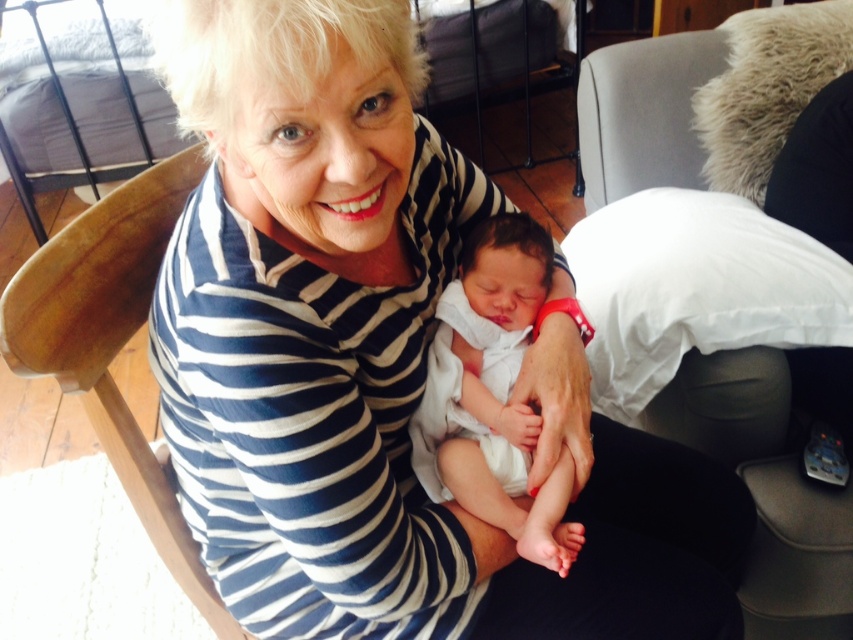
Question: Is white striped shirt at center thinner than white fabric armchair at lower right?

Choices:
 (A) no
 (B) yes

Answer: (A)

Question: Among these objects, which one is nearest to the camera?

Choices:
 (A) white soft cloth at center
 (B) white fabric armchair at lower right

Answer: (A)

Question: Which object is the farthest from the white soft cloth at center?

Choices:
 (A) white fabric armchair at lower right
 (B) white striped shirt at center

Answer: (A)

Question: Does white striped shirt at center appear over white fabric armchair at lower right?

Choices:
 (A) no
 (B) yes

Answer: (A)

Question: Which of the following is the closest to the observer?

Choices:
 (A) white soft cloth at center
 (B) white fabric armchair at lower right

Answer: (A)

Question: Does white fabric armchair at lower right lie in front of white soft cloth at center?

Choices:
 (A) no
 (B) yes

Answer: (A)